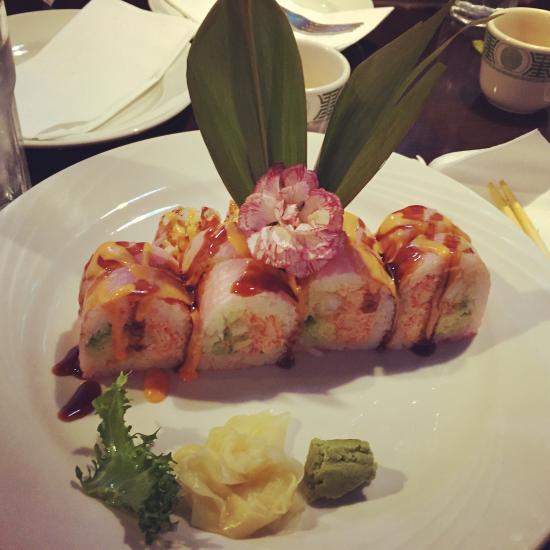
You are a GUI agent. You are given a task and a screenshot of the screen. Output one action in this format:
    pyautogui.click(x=<x>, y=<y>)
    Task: Click on the chop sticks
    This screenshot has width=550, height=550.
    Given the screenshot: What is the action you would take?
    pyautogui.click(x=527, y=214), pyautogui.click(x=503, y=209)